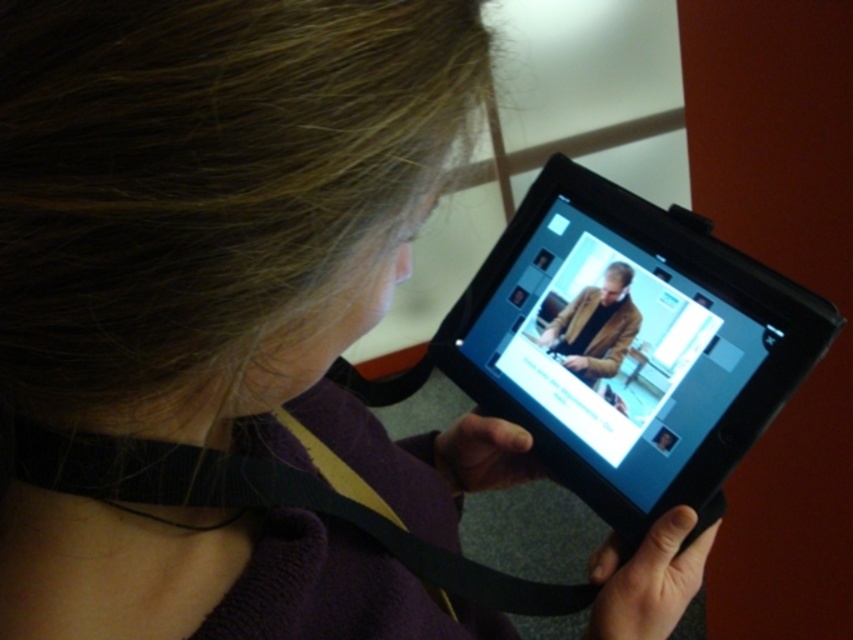
Question: Considering the relative positions of black plastic tablet at center and brown leather jacket at center in the image provided, where is black plastic tablet at center located with respect to brown leather jacket at center?

Choices:
 (A) left
 (B) right

Answer: (A)

Question: Does black plastic tablet at center have a larger size compared to brown leather jacket at center?

Choices:
 (A) no
 (B) yes

Answer: (B)

Question: Among these objects, which one is nearest to the camera?

Choices:
 (A) brown leather jacket at center
 (B) black plastic tablet at center

Answer: (B)

Question: Is black plastic tablet at center to the left of brown leather jacket at center from the viewer's perspective?

Choices:
 (A) no
 (B) yes

Answer: (B)

Question: Among these objects, which one is farthest from the camera?

Choices:
 (A) black plastic tablet at center
 (B) brown leather jacket at center

Answer: (B)